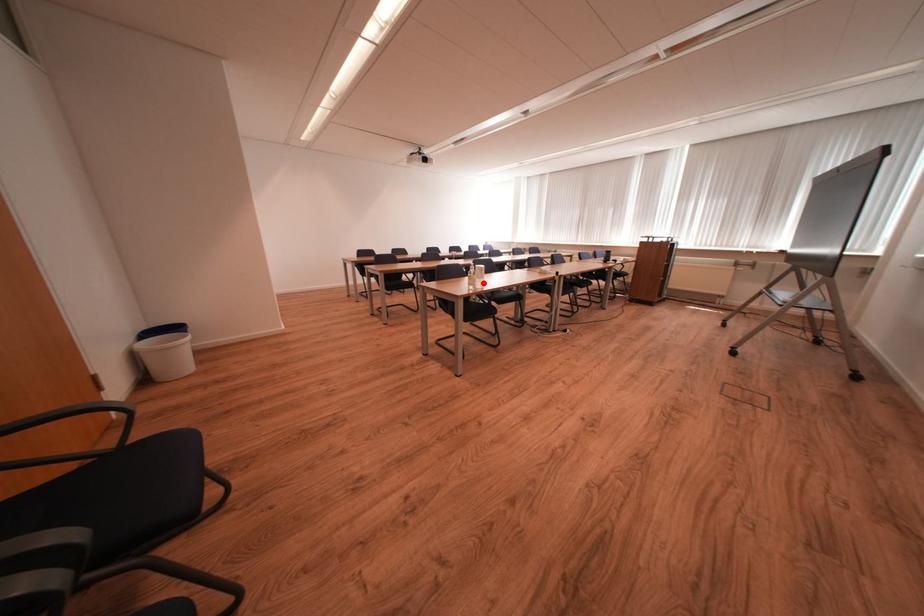
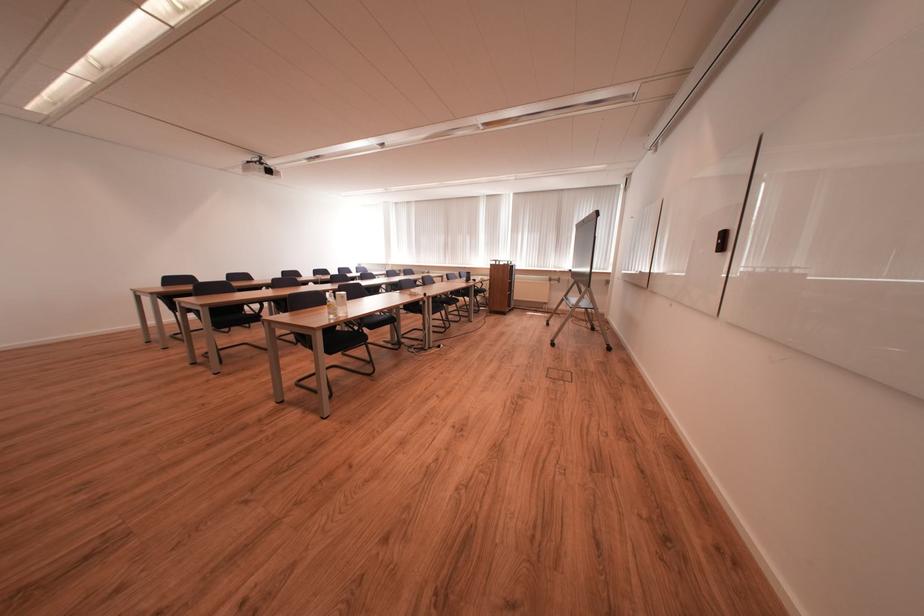
The point at the highlighted location is marked in the first image. Where is the corresponding point in the second image?

(344, 310)